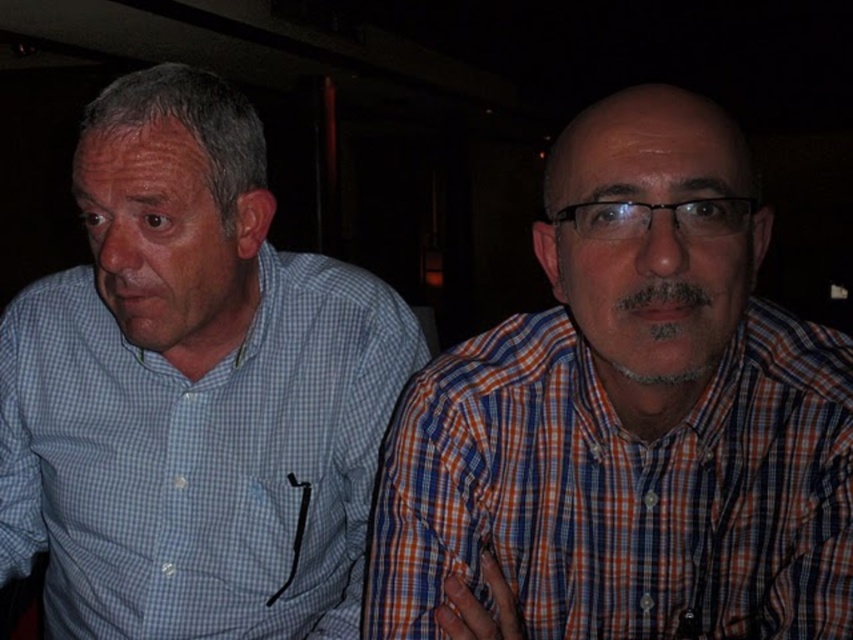
You are a photographer adjusting the lighting in a dimly lit room where two people are seated. You need to ensure that the orange plaid shirt at right and the black plastic glasses at center are both well illuminated. Given their positions and sizes, which object should you focus the light on first to ensure proper exposure?

The orange plaid shirt at right has a greater height compared to the black plastic glasses at center, so you should focus the light on the orange plaid shirt at right first to ensure proper exposure.

You are a photographer trying to capture a clear shot of both the blue checkered shirt at left and the black plastic glasses at center. Based on their positions, which object should you focus on first to ensure both are in focus?

The blue checkered shirt at left is positioned under black plastic glasses at center. To ensure both are in focus, you should focus on the black plastic glasses at center first since it is closer to the camera, and the shirt will be in the background plane of focus.